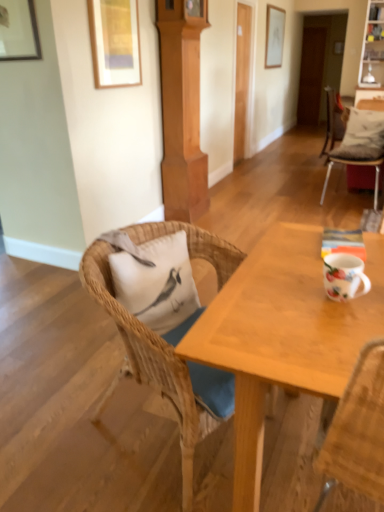
Question: Is the depth of white matte pillow at left, which ranks as the 1th pillow in bottom-to-top order, less than that of white cushioned chair at right, the first chair positioned from the back?

Choices:
 (A) yes
 (B) no

Answer: (A)

Question: Is white cushioned chair at right, the first chair positioned from the back, at the back of white matte pillow at left, the first pillow positioned from the left?

Choices:
 (A) yes
 (B) no

Answer: (B)

Question: Is the position of white matte pillow at left, the first pillow positioned from the left, more distant than that of white cushioned chair at right, which is counted as the second chair, starting from the left?

Choices:
 (A) yes
 (B) no

Answer: (B)

Question: From the image's perspective, is white matte pillow at left, acting as the 2th pillow starting from the back, under white cushioned chair at right, which is counted as the 2th chair, starting from the bottom?

Choices:
 (A) yes
 (B) no

Answer: (A)

Question: Is white matte pillow at left, which ranks as the 1th pillow in bottom-to-top order, in contact with white cushioned chair at right, which is counted as the second chair, starting from the left?

Choices:
 (A) yes
 (B) no

Answer: (B)

Question: Do you think wooden picture frame at upper left, the 3th picture frame in the top-to-bottom sequence, is within matte wooden picture frame at upper left, acting as the second picture frame starting from the bottom, or outside of it?

Choices:
 (A) inside
 (B) outside

Answer: (B)

Question: Does point coord(6,42) appear closer or farther from the camera than point coord(140,74)?

Choices:
 (A) farther
 (B) closer

Answer: (B)

Question: From a real-world perspective, relative to matte wooden picture frame at upper left, which is the second picture frame from left to right, is wooden picture frame at upper left, the 3th picture frame in the top-to-bottom sequence, vertically above or below?

Choices:
 (A) below
 (B) above

Answer: (B)

Question: In the image, is wooden picture frame at upper left, positioned as the 1th picture frame in left-to-right order, on the left side or the right side of matte wooden picture frame at upper left, acting as the second picture frame starting from the bottom?

Choices:
 (A) right
 (B) left

Answer: (B)

Question: From their relative heights in the image, would you say woven wood chair at center, positioned as the second chair in top-to-bottom order, is taller or shorter than white matte pillow at left, the first pillow viewed from the front?

Choices:
 (A) tall
 (B) short

Answer: (A)

Question: In terms of size, does woven wood chair at center, which is the 1th chair in left-to-right order, appear bigger or smaller than white matte pillow at left, acting as the second pillow starting from the top?

Choices:
 (A) small
 (B) big

Answer: (B)

Question: In the image, is woven wood chair at center, which ranks as the second chair in right-to-left order, on the left side or the right side of white matte pillow at left, which ranks as the 1th pillow in bottom-to-top order?

Choices:
 (A) right
 (B) left

Answer: (A)

Question: Which is correct: woven wood chair at center, which ranks as the second chair in right-to-left order, is inside white matte pillow at left, which ranks as the 1th pillow in bottom-to-top order, or outside of it?

Choices:
 (A) inside
 (B) outside

Answer: (B)

Question: In the image, is white fabric pillow at upper right, the second pillow positioned from the left, positioned in front of or behind white glossy mug at right?

Choices:
 (A) front
 (B) behind

Answer: (B)

Question: Looking at their shapes, would you say white fabric pillow at upper right, which is counted as the first pillow, starting from the right, is wider or thinner than white glossy mug at right?

Choices:
 (A) wide
 (B) thin

Answer: (A)